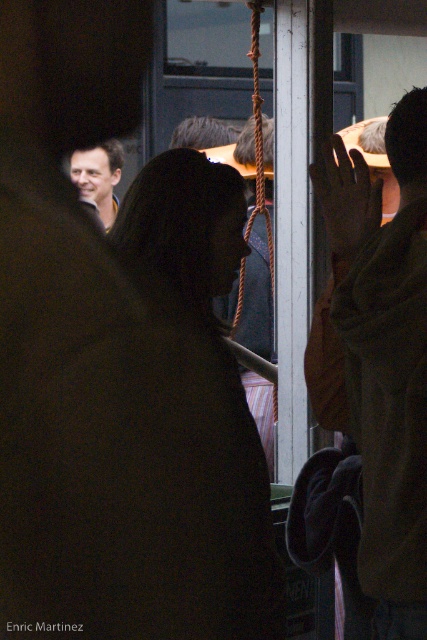
Question: Which object appears closest to the camera in this image?

Choices:
 (A) brown fuzzy jacket at right
 (B) black matte coat at center
 (C) matte black jacket at upper left

Answer: (B)

Question: Which of the following is the farthest from the observer?

Choices:
 (A) brown fuzzy jacket at right
 (B) black matte coat at center
 (C) matte black jacket at upper left

Answer: (C)

Question: Does brown fuzzy jacket at right have a smaller size compared to matte black jacket at upper left?

Choices:
 (A) yes
 (B) no

Answer: (B)

Question: Does black matte coat at center have a smaller size compared to brown fuzzy jacket at right?

Choices:
 (A) no
 (B) yes

Answer: (A)

Question: Based on their relative distances, which object is nearer to the black matte coat at center?

Choices:
 (A) matte black jacket at upper left
 (B) brown fuzzy jacket at right

Answer: (B)

Question: Does black matte coat at center have a greater width compared to brown fuzzy jacket at right?

Choices:
 (A) yes
 (B) no

Answer: (A)